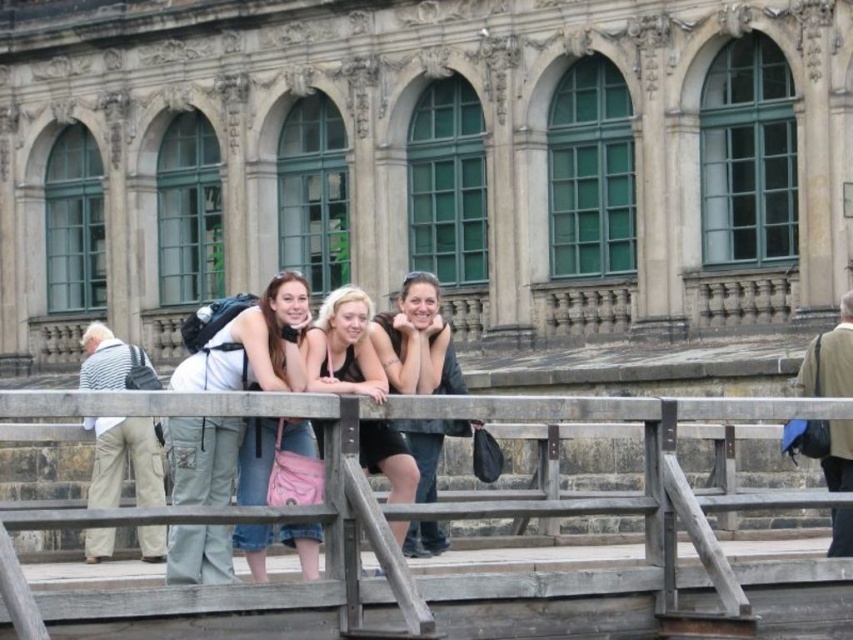
Can you confirm if wooden at center is positioned below striped fabric shirt at left?

Yes.

You are a GUI agent. You are given a task and a screenshot of the screen. Output one action in this format:
    pyautogui.click(x=<x>, y=<y>)
    Task: Click on the wooden at center
    
    Given the screenshot: What is the action you would take?
    pyautogui.click(x=427, y=515)

This screenshot has height=640, width=853. Find the location of `wooden at center`. wooden at center is located at coordinates (427, 515).

Is wooden at center taller than denim jeans at center?

No.

Is wooden at center further to the viewer compared to denim jeans at center?

No, wooden at center is closer to the viewer.

Who is more forward, (142, 614) or (308, 564)?

Point (142, 614) is more forward.

This screenshot has height=640, width=853. Find the location of `wooden at center`. wooden at center is located at coordinates (427, 515).

Which is below, matte black shirt at center or striped fabric shirt at left?

striped fabric shirt at left is below.

Describe the element at coordinates (416, 340) in the screenshot. The height and width of the screenshot is (640, 853). I see `matte black shirt at center` at that location.

Which is behind, point (424, 368) or point (86, 502)?

The point (86, 502) is more distant.

Identify the location of matte black shirt at center. (416, 340).